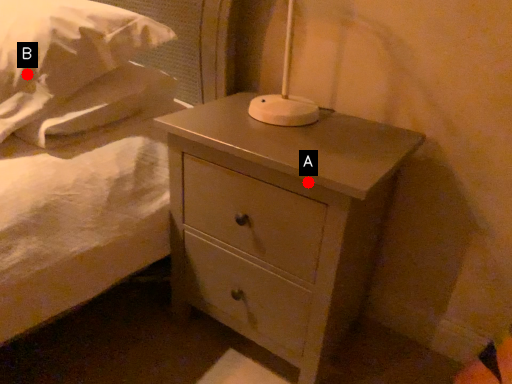
Question: Two points are circled on the image, labeled by A and B beside each circle. Which point is further to the camera?

Choices:
 (A) A is further
 (B) B is further

Answer: (B)